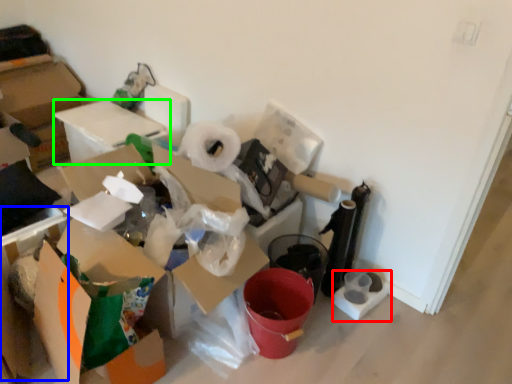
Question: Which object is the farthest from toilet paper (highlighted by a red box)? Choose among these: cardboard box (highlighted by a blue box) or cardboard box (highlighted by a green box).

Choices:
 (A) cardboard box
 (B) cardboard box

Answer: (B)